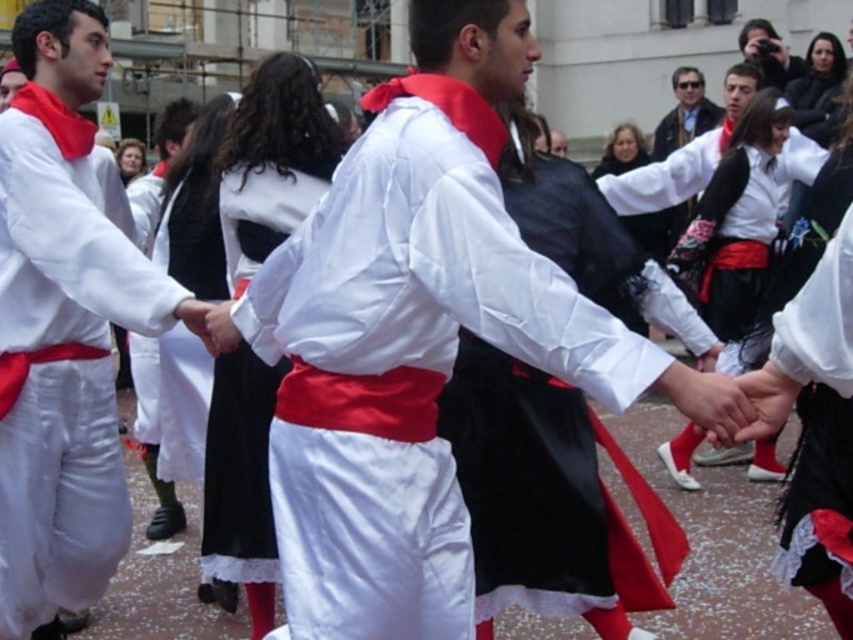
From the picture: You are a photographer at the event and want to capture a photo of the white satin shirt at center and the matte black jacket at upper center. Which object is positioned lower in the image?

The white satin shirt at center is located below the matte black jacket at upper center, so the white satin shirt at center is positioned lower in the image.

You are a photographer trying to capture a group photo of the dancers. You notice the white cotton shirt at center and the matte black jacket at upper center. Which of these two items would appear wider in the photo?

The white cotton shirt at center would appear wider in the photo since its width is larger than that of the matte black jacket at upper center according to the description.

You are a photographer trying to capture a photo of the white cotton shirt at center and the matte black jacket at upper center. Which object should you focus on first if you want to capture both in the same frame without moving the camera?

Since the white cotton shirt at center is to the left of matte black jacket at upper center, you should focus on the white cotton shirt at center first as it is positioned closer to the left side of the frame, allowing both objects to be captured in the same shot without moving the camera.